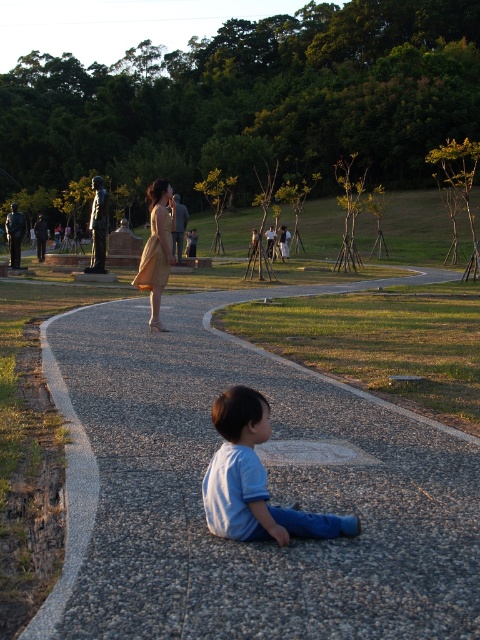
Is gray gravel path at lower center to the left of matte beige dress at center from the viewer's perspective?

No, gray gravel path at lower center is not to the left of matte beige dress at center.

Does point (135, 628) come in front of point (167, 268)?

Yes, it is in front of point (167, 268).

Is point (429, 611) farther from camera compared to point (155, 292)?

No, it is in front of (155, 292).

Image resolution: width=480 pixels, height=640 pixels. I want to click on gray gravel path at lower center, so click(268, 484).

Can you confirm if gray gravel path at lower center is positioned below light blue cotton shirt at lower center?

Incorrect, gray gravel path at lower center is not positioned below light blue cotton shirt at lower center.

Does gray gravel path at lower center have a smaller size compared to light blue cotton shirt at lower center?

Actually, gray gravel path at lower center might be larger than light blue cotton shirt at lower center.

This screenshot has width=480, height=640. What do you see at coordinates (268, 484) in the screenshot?
I see `gray gravel path at lower center` at bounding box center [268, 484].

At what (x,y) coordinates should I click in order to perform the action: click on gray gravel path at lower center. Please return your answer as a coordinate pair (x, y). Looking at the image, I should click on (268, 484).

Can you confirm if matte beige dress at center is wider than light beige fabric dress at center?

No.

Between point (148, 324) and point (142, 262), which one is positioned in front?

Positioned in front is point (142, 262).

Who is more forward, (160, 179) or (170, 241)?

Point (170, 241)

Locate an element on the screen. This screenshot has height=640, width=480. matte beige dress at center is located at coordinates (156, 248).